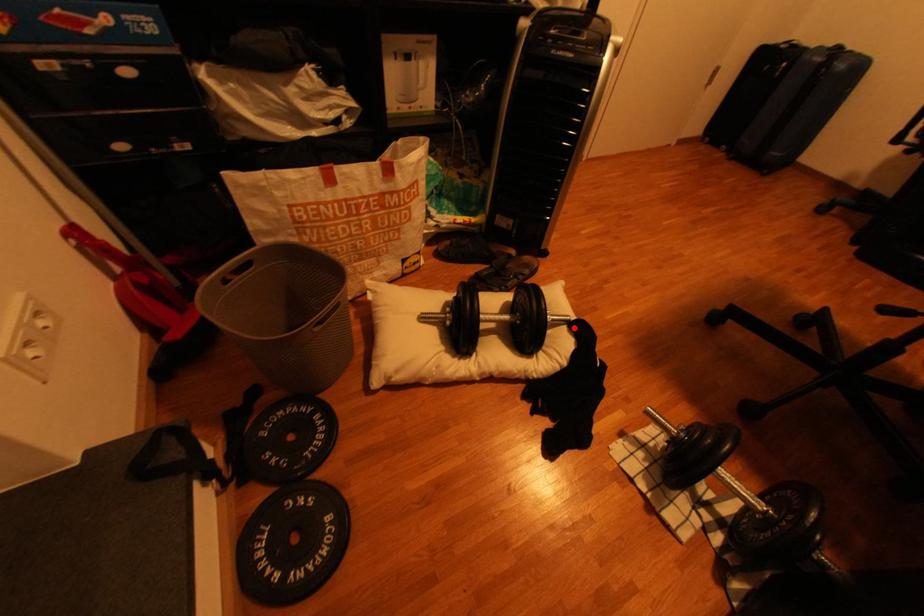
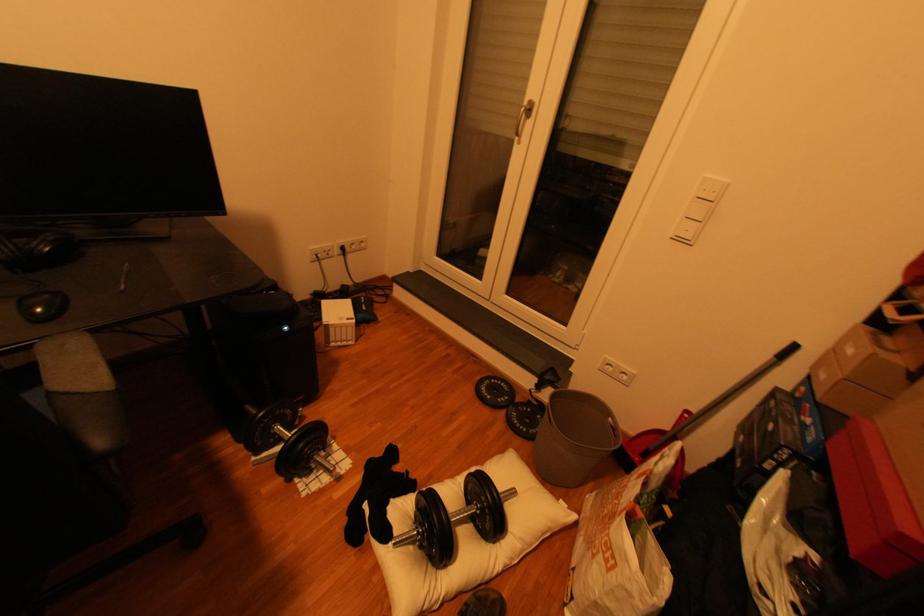
Question: I am providing you with two images of the same scene from different viewpoints. In image1, a red point is highlighted. Considering the same 3D point in image2, which of the following is correct?

Choices:
 (A) It is closer
 (B) It is farther

Answer: (A)